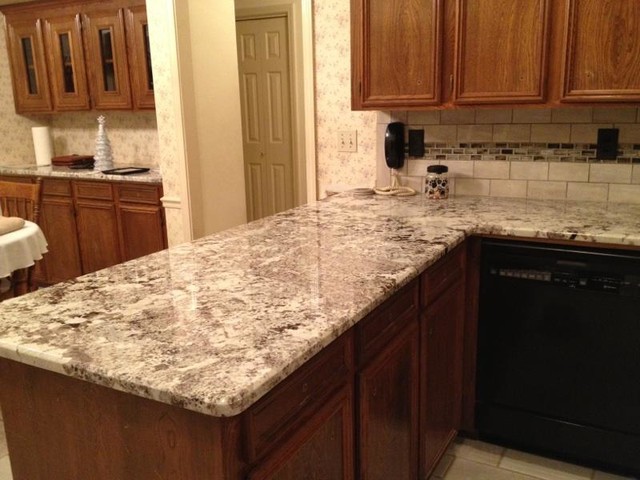
Find the location of `3 brown stained cubbards above dishwasher counter`. 3 brown stained cubbards above dishwasher counter is located at coordinates (424, 63), (513, 34), (598, 65).